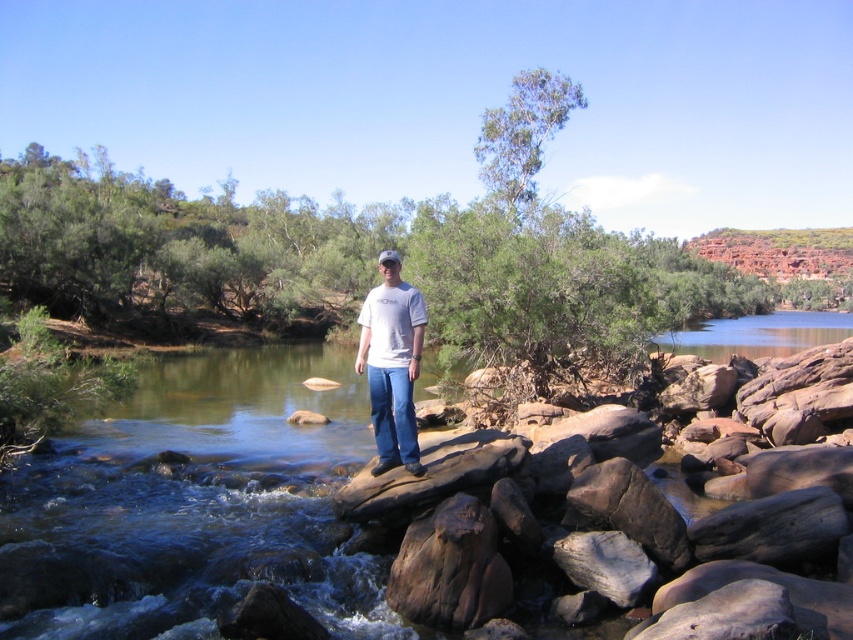
In the scene shown: Who is lower down, clear water at stream center or white cotton t-shirt at center?

clear water at stream center is below.

Does point (315, 474) lie behind point (407, 396)?

Yes, point (315, 474) is behind point (407, 396).

Is point (20, 481) in front of point (374, 356)?

No, (20, 481) is further to viewer.

This screenshot has width=853, height=640. Identify the location of clear water at stream center. (194, 506).